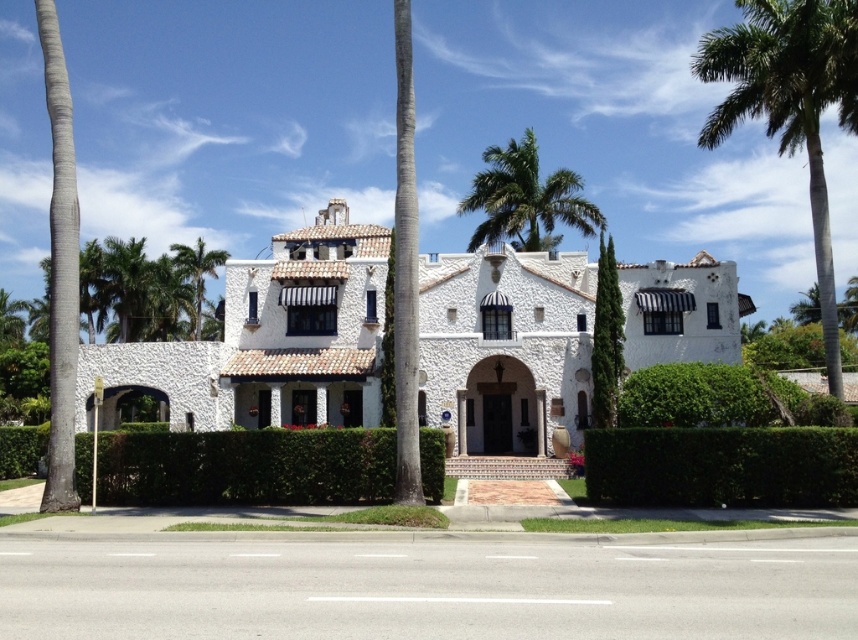
You are standing in front of the house and want to water both the green leafy palm tree at upper right and the green leafy palm tree at left. Which palm tree should you water first if you want to start with the one nearest to you?

You should water the green leafy palm tree at upper right first because it is closer to the viewer than the green leafy palm tree at left.

You are a drone operator tasked with capturing aerial footage of the white stucco mansion at center. Your drone has a maximum flight range of 40 meters. Can your drone safely reach the mansion from your current position without exceeding its range limit?

The distance between the white stucco mansion at center and the viewer is 39.14 meters, which is within the drone operator drone maximum flight range of 40 meters. Yes, the drone can safely reach the mansion without exceeding its range limit.

You are a landscape architect planning to install a new garden feature between the white stucco mansion at center and the green leafy hedge at center. Considering their heights, which object should you place the feature closer to for better visibility?

The white stucco mansion at center is taller than the green leafy hedge at center, so placing the garden feature closer to the mansion would ensure better visibility against its taller structure.